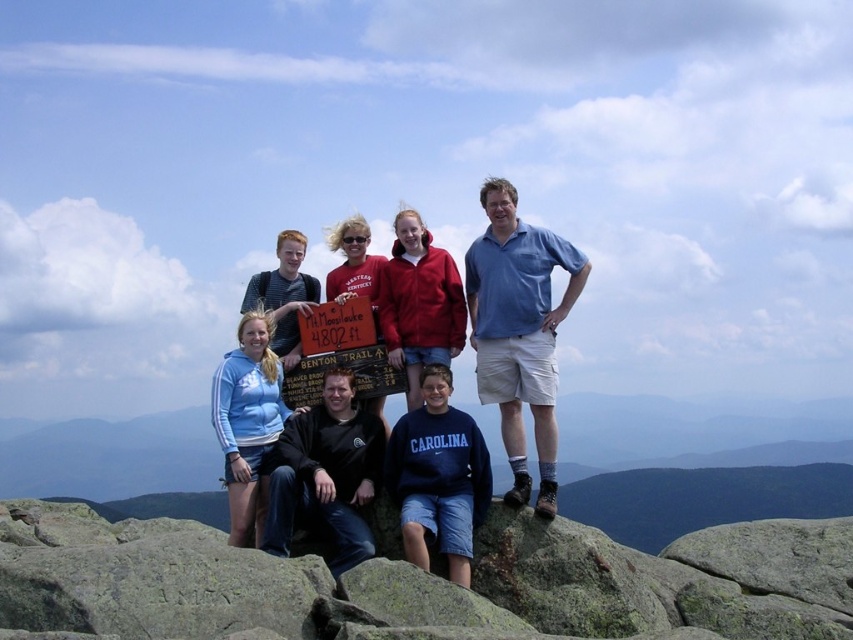
Question: Which of these objects is positioned closest to the light blue fleece at center?

Choices:
 (A) matte blue sweatshirt at center
 (B) blue cotton sweatshirt at center

Answer: (B)

Question: Which object appears closest to the camera in this image?

Choices:
 (A) matte blue sweatshirt at center
 (B) light blue fleece at center
 (C) blue cotton shirt at center
 (D) blue cotton sweatshirt at center

Answer: (A)

Question: Can you confirm if matte blue sweatshirt at center is bigger than blue cotton shirt at center?

Choices:
 (A) yes
 (B) no

Answer: (A)

Question: Is blue cotton shirt at center bigger than black matte jacket at center?

Choices:
 (A) no
 (B) yes

Answer: (B)

Question: Which of the following is the closest to the observer?

Choices:
 (A) red fleece jacket at center
 (B) blue cotton shirt at center
 (C) black matte jacket at center

Answer: (C)

Question: Does blue cotton shirt at center lie behind red fleece jacket at center?

Choices:
 (A) no
 (B) yes

Answer: (A)